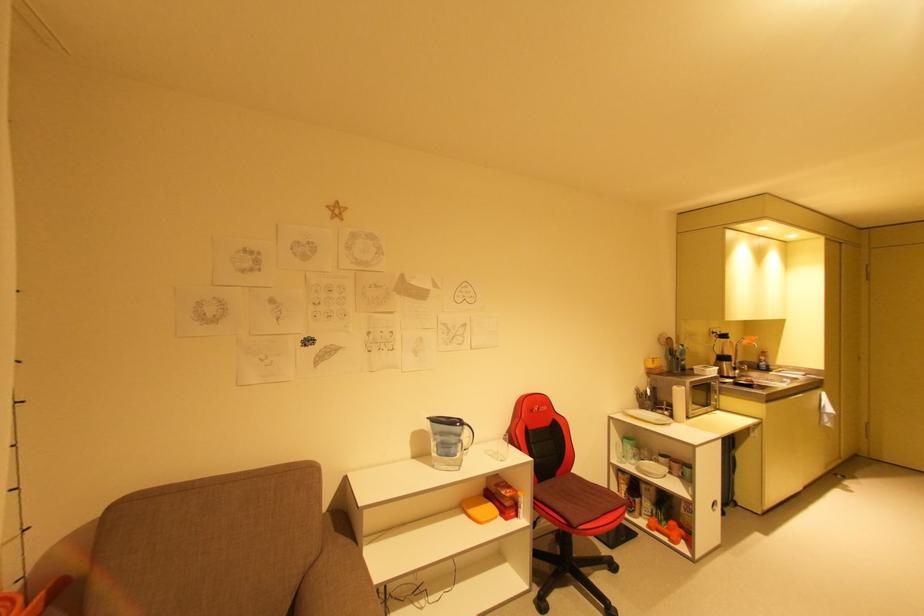
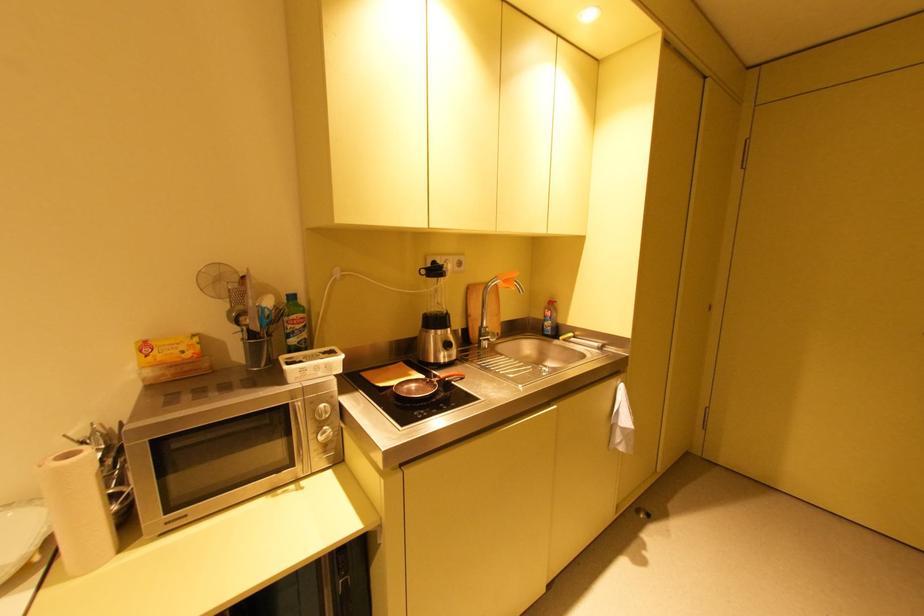
The point at (658, 361) is marked in the first image. Where is the corresponding point in the second image?

(150, 347)